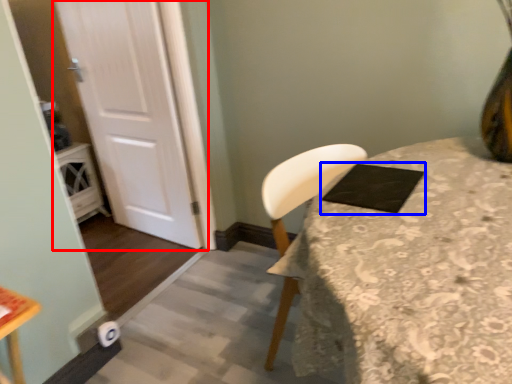
Question: Which object appears farthest to the camera in this image, door (highlighted by a red box) or pad (highlighted by a blue box)?

Choices:
 (A) door
 (B) pad

Answer: (A)